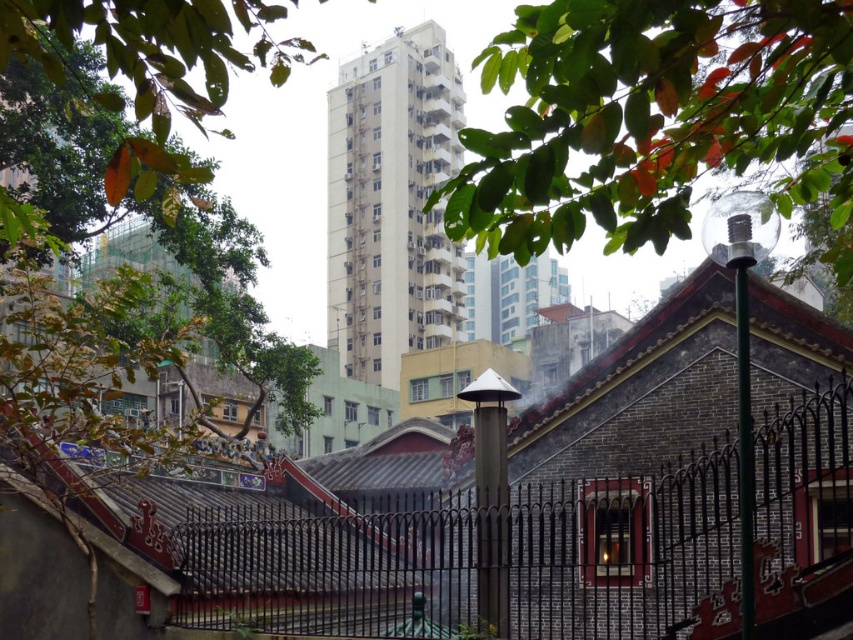
Based on the photo, who is more distant from viewer, (590,481) or (222,216)?

The point (222,216) is more distant.

Can you confirm if black wrought iron fence at lower left is positioned to the left of green leafy tree at left?

No, black wrought iron fence at lower left is not to the left of green leafy tree at left.

Locate an element on the screen. The height and width of the screenshot is (640, 853). black wrought iron fence at lower left is located at coordinates (479, 560).

Between black wrought iron fence at lower left and green leafy tree at upper center, which one has more height?

With more height is green leafy tree at upper center.

Identify the location of black wrought iron fence at lower left. pyautogui.click(x=479, y=560).

Is the position of green leafy tree at upper center more distant than that of green leafy tree at left?

Yes.

Consider the image. Is green leafy tree at upper center shorter than green leafy tree at left?

Correct, green leafy tree at upper center is not as tall as green leafy tree at left.

Which is behind, point (540, 10) or point (254, 4)?

Point (254, 4)

Identify the location of green leafy tree at upper center. (653, 116).